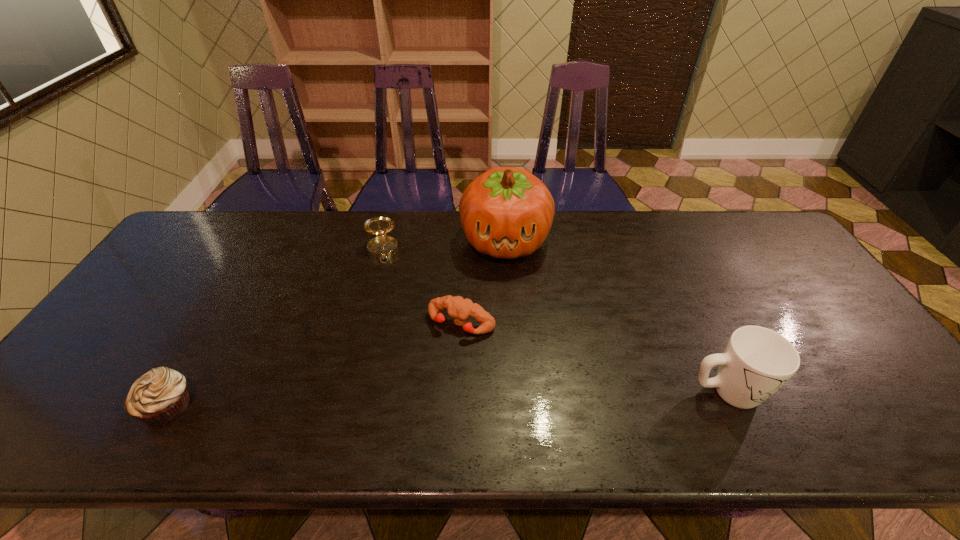
Identify the location of free space on the desktop that is between the fourth tallest object and the rightmost object and is positioned with the gloves of the shortest object facing forward. This screenshot has height=540, width=960. click(x=416, y=400).

Locate an element on the screen. The height and width of the screenshot is (540, 960). free spot on the desktop that is between the leftmost object and the rightmost object and is positioned with the dial facing the second object from left to right is located at coordinates (396, 400).

Identify the location of free space on the desktop that is between the leftmost object and the rightmost object and is positioned on the side of the tallest object with the cute face. This screenshot has width=960, height=540. (497, 397).